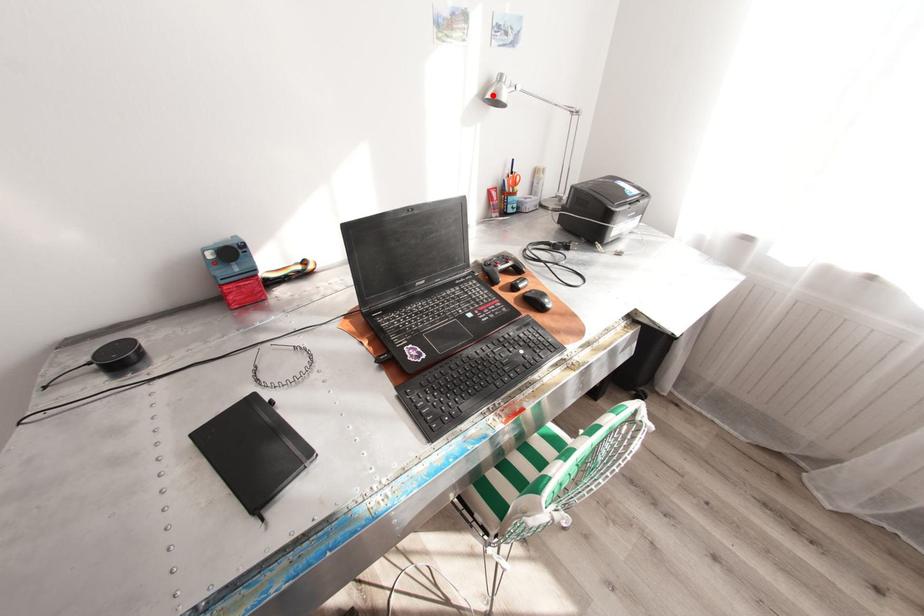
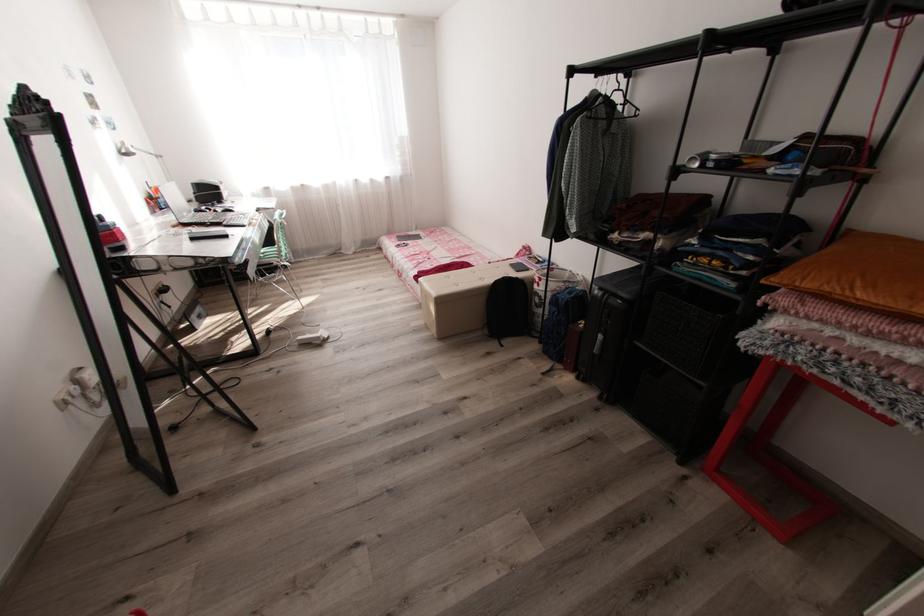
Find the pixel in the second image that matches the highlighted location in the first image.

(129, 151)